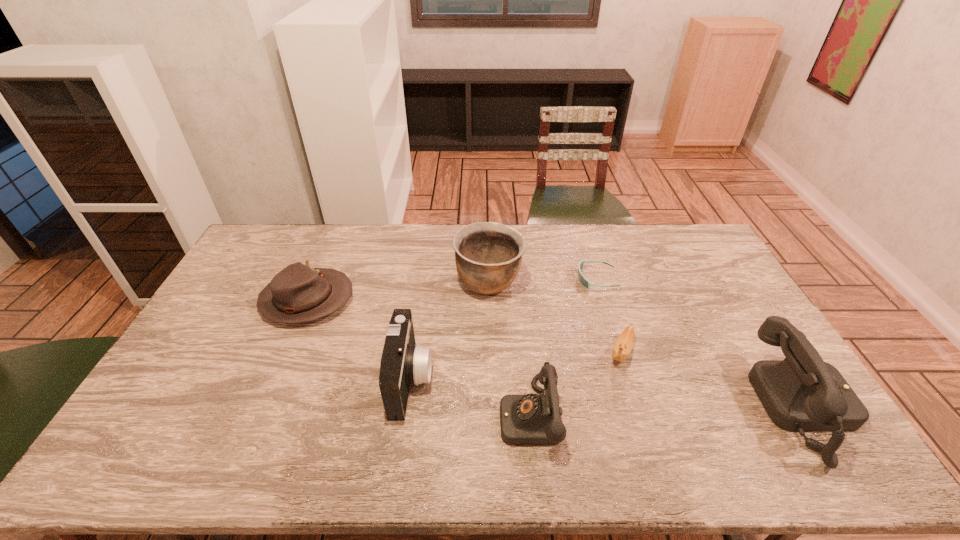
The height and width of the screenshot is (540, 960). In order to click on vacant space situated 0.380m on the dial of the shorter telephone in this screenshot , I will do `click(354, 416)`.

Where is `vacant region located on the dial of the shorter telephone`? The width and height of the screenshot is (960, 540). vacant region located on the dial of the shorter telephone is located at coordinates (420, 416).

Image resolution: width=960 pixels, height=540 pixels. Find the location of `free spot located 0.110m on the dial of the shorter telephone`. free spot located 0.110m on the dial of the shorter telephone is located at coordinates (458, 416).

In order to click on vacant point located on the front-facing side of the goggles in this screenshot , I will do `click(548, 280)`.

The width and height of the screenshot is (960, 540). Identify the location of blank area located on the front-facing side of the goggles. (511, 280).

The width and height of the screenshot is (960, 540). What are the coordinates of `free spot located on the front-facing side of the goggles` in the screenshot? It's located at (531, 280).

Identify the location of vacant space located on the front of the pottery. The width and height of the screenshot is (960, 540). (x=491, y=359).

The height and width of the screenshot is (540, 960). What are the coordinates of `free location located 0.250m on the decorative side of the fifth tallest object` in the screenshot? It's located at (428, 300).

The image size is (960, 540). Identify the location of free space located 0.220m on the right of the sixth tallest object. (710, 352).

Where is `free spot located on the lens of the camcorder`? This screenshot has width=960, height=540. free spot located on the lens of the camcorder is located at coordinates (470, 379).